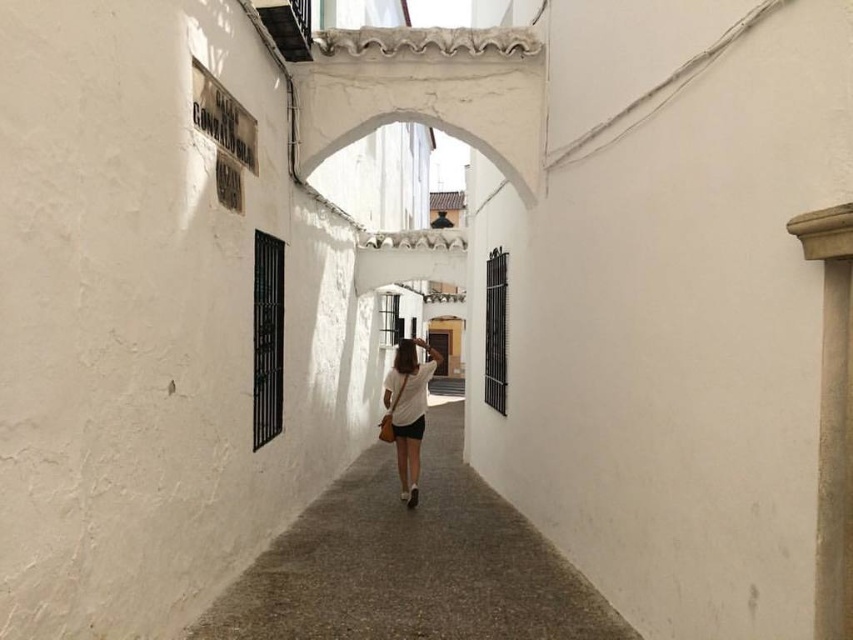
You are walking down a narrow alleyway in a Mediterranean town and notice a smooth concrete path at center and a white cotton shirt at center. Which object takes up more space in the scene?

The smooth concrete path at center is bigger than the white cotton shirt at center, so the smooth concrete path at center takes up more space in the scene.